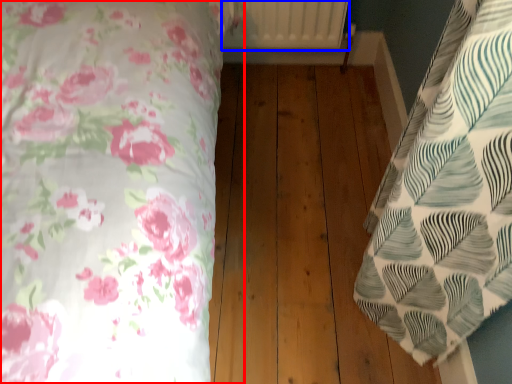
Question: Which object is further to the camera taking this photo, bed (highlighted by a red box) or radiator (highlighted by a blue box)?

Choices:
 (A) bed
 (B) radiator

Answer: (B)